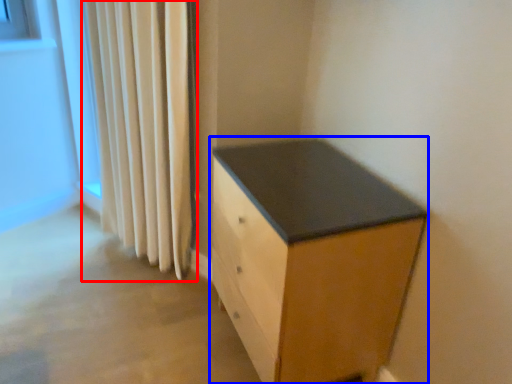
Question: Which point is closer to the camera, curtain (highlighted by a red box) or chest of drawers (highlighted by a blue box)?

Choices:
 (A) curtain
 (B) chest of drawers

Answer: (B)